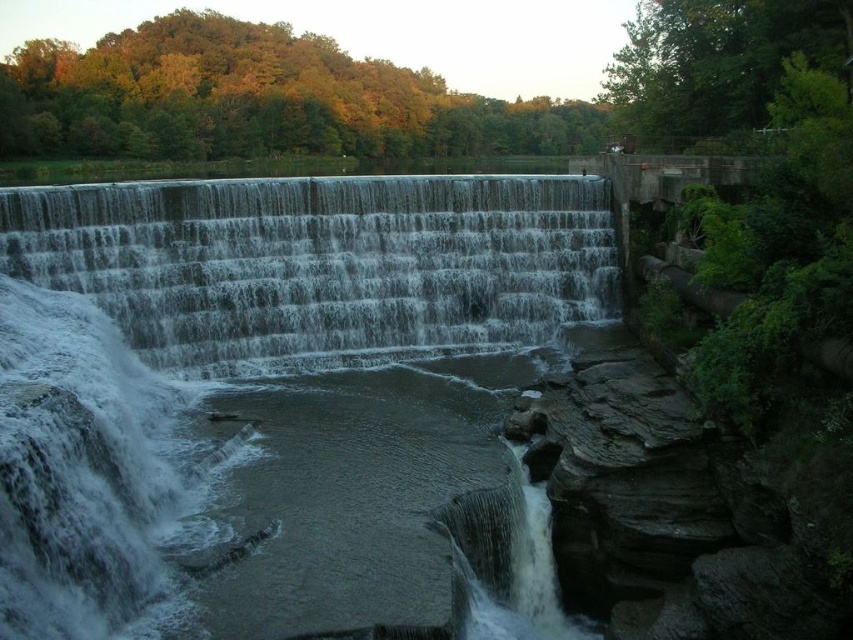
Question: Can you confirm if clear water at center is thinner than gray concrete waterfall at center?

Choices:
 (A) no
 (B) yes

Answer: (B)

Question: Is clear water at center thinner than gray concrete waterfall at center?

Choices:
 (A) yes
 (B) no

Answer: (A)

Question: Among these objects, which one is nearest to the camera?

Choices:
 (A) gray concrete waterfall at center
 (B) clear water at center

Answer: (B)

Question: Is clear water at center below gray concrete waterfall at center?

Choices:
 (A) no
 (B) yes

Answer: (B)

Question: Which point is farther from the camera taking this photo?

Choices:
 (A) (399, 198)
 (B) (376, 268)

Answer: (A)